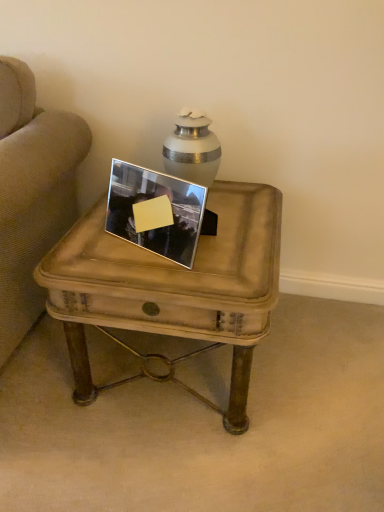
Locate an element on the screen. free space in front of silver metallic picture frame at center is located at coordinates [x=161, y=275].